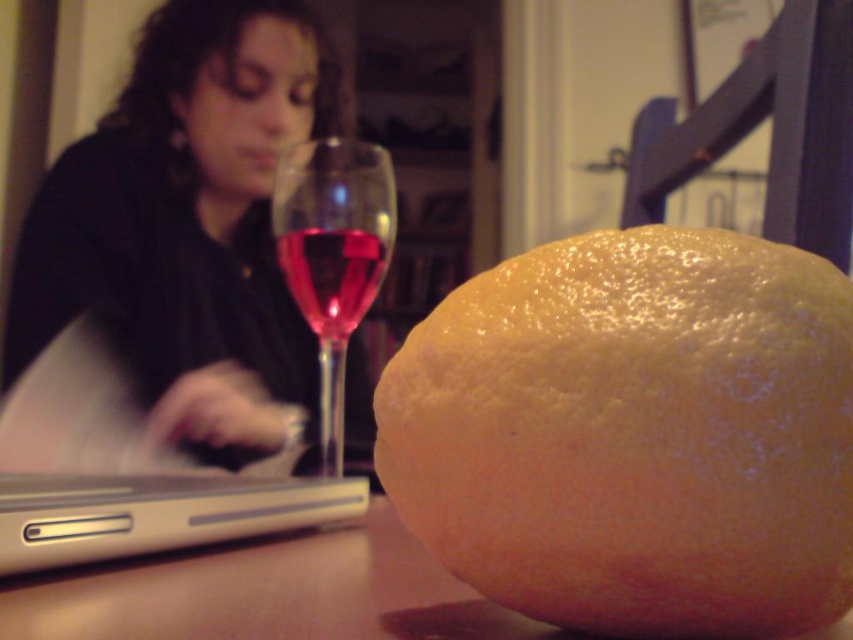
Question: Which of the following is the closest to the observer?

Choices:
 (A) (463, 600)
 (B) (335, 413)
 (C) (225, 292)
 (D) (73, 449)

Answer: (A)

Question: Can you confirm if silver metallic laptop at lower left is thinner than translucent glass wine at center?

Choices:
 (A) yes
 (B) no

Answer: (B)

Question: Is dark hair at upper left to the left of silver metallic laptop at lower left from the viewer's perspective?

Choices:
 (A) no
 (B) yes

Answer: (B)

Question: Estimate the real-world distances between objects in this image. Which object is farther from the silver metallic laptop at left?

Choices:
 (A) translucent glass wine at center
 (B) transparent glass wine glass at left

Answer: (A)

Question: Estimate the real-world distances between objects in this image. Which object is closer to the translucent glass wine at center?

Choices:
 (A) transparent glass wine glass at left
 (B) silver metallic laptop at lower left

Answer: (A)

Question: In this image, where is dark hair at upper left located relative to smooth wooden table at lower center?

Choices:
 (A) right
 (B) left

Answer: (B)